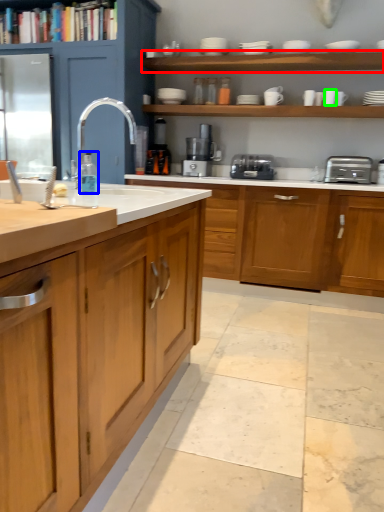
Question: Which object is the farthest from shelf (highlighted by a red box)? Choose among these: bottle (highlighted by a blue box) or tableware (highlighted by a green box).

Choices:
 (A) bottle
 (B) tableware

Answer: (A)